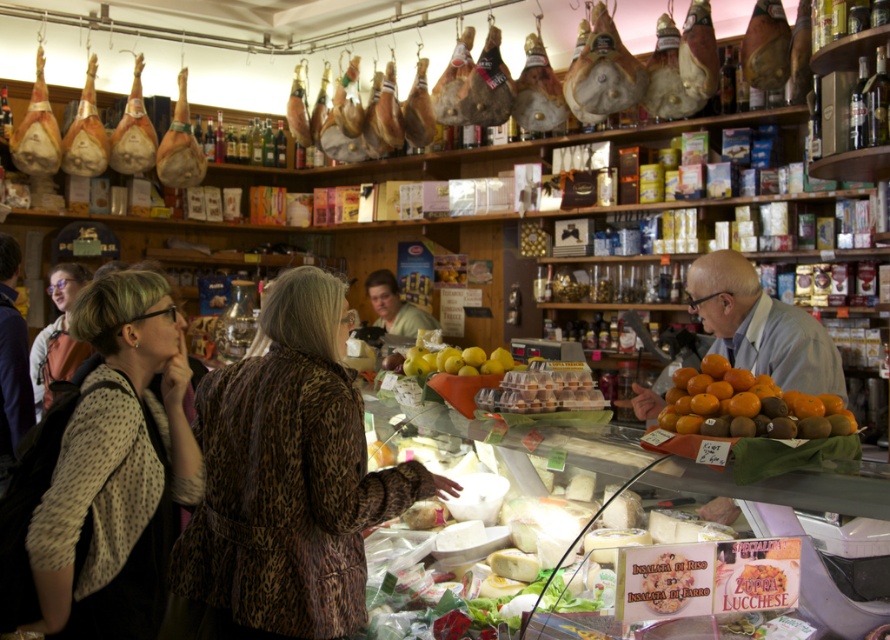
Which is more to the left, matte black jacket at left or yellow matte lemons at center?

Positioned to the left is matte black jacket at left.

Which is behind, point (57, 353) or point (409, 358)?

Point (57, 353)

Where is `matte black jacket at left`? matte black jacket at left is located at coordinates pyautogui.click(x=57, y=336).

Which is below, leopard print coat at center or matte black jacket at left?

Positioned lower is leopard print coat at center.

Does point (229, 570) come behind point (43, 330)?

No, (229, 570) is closer to viewer.

The image size is (890, 640). I want to click on leopard print coat at center, so click(284, 484).

Which of these two, leopard print coat at center or orange matte at center, stands taller?

With more height is leopard print coat at center.

At what (x,y) coordinates should I click in order to perform the action: click on leopard print coat at center. Please return your answer as a coordinate pair (x, y). The height and width of the screenshot is (640, 890). Looking at the image, I should click on (284, 484).